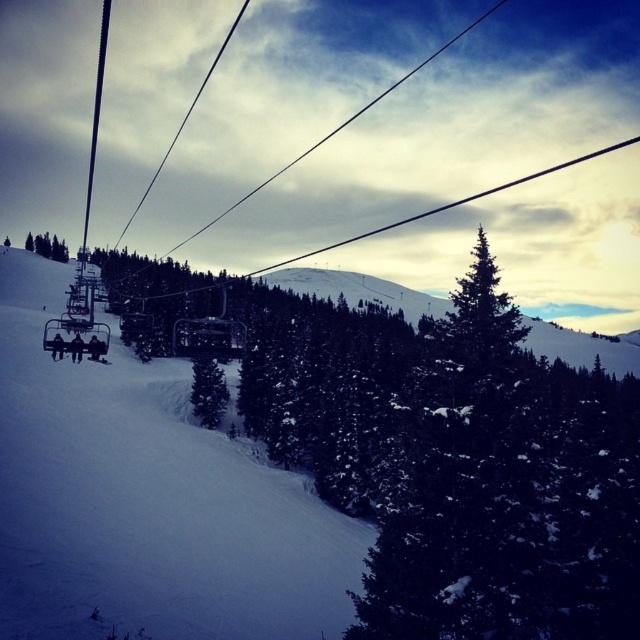
Question: Considering the relative positions of white snow at center and green textured pine tree at center in the image provided, where is white snow at center located with respect to green textured pine tree at center?

Choices:
 (A) below
 (B) above

Answer: (B)

Question: In this image, where is white snow at center located relative to green matte tree at upper left?

Choices:
 (A) right
 (B) left

Answer: (A)

Question: Which object is closer to the camera taking this photo?

Choices:
 (A) green matte tree at center
 (B) green textured pine tree at center

Answer: (B)

Question: Which is farther from the green matte tree at center?

Choices:
 (A) green textured pine tree at center
 (B) green matte tree at upper left
 (C) white snow at center

Answer: (B)

Question: Is green textured pine tree at center below green matte tree at upper left?

Choices:
 (A) yes
 (B) no

Answer: (A)

Question: Among these points, which one is farthest from the camera?

Choices:
 (A) (33, 240)
 (B) (408, 442)

Answer: (A)